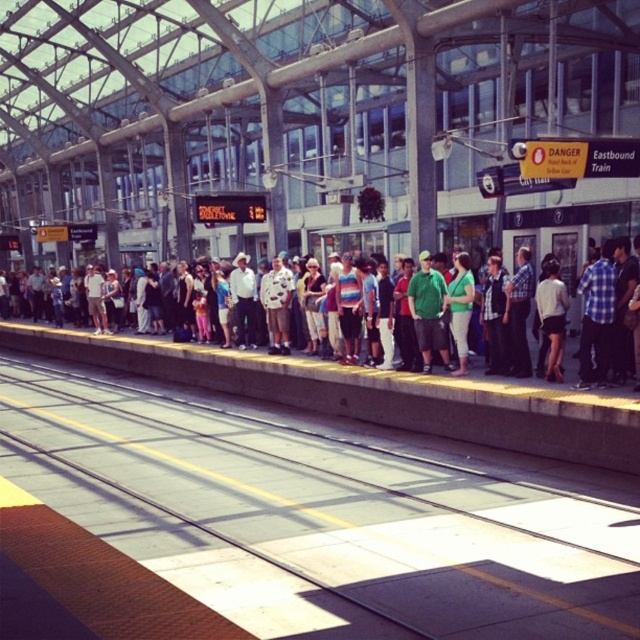
You are a photographer standing on the platform and want to capture a photo of the smooth concrete train track at center and the multicolored casual clothing at center. Which object appears wider in the photo?

The multicolored casual clothing at center appears wider in the photo because the smooth concrete train track at center has a lesser width compared to it.

You are a person standing on the platform and want to know if the smooth concrete train track at center is above or below the multicolored casual clothing at center. What is the relationship between them?

The smooth concrete train track at center is below the multicolored casual clothing at center, meaning the clothing is above the track.